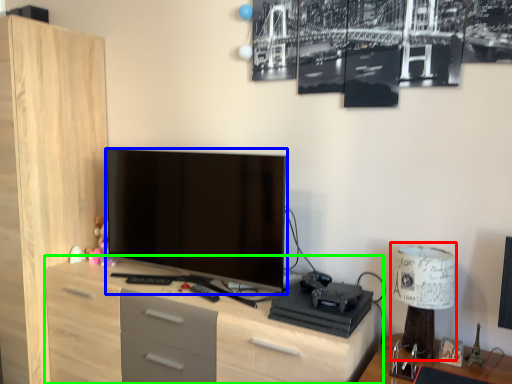
Question: Based on their relative distances, which object is nearer to table lamp (highlighted by a red box)? Choose from television (highlighted by a blue box) and chest of drawers (highlighted by a green box).

Choices:
 (A) television
 (B) chest of drawers

Answer: (B)